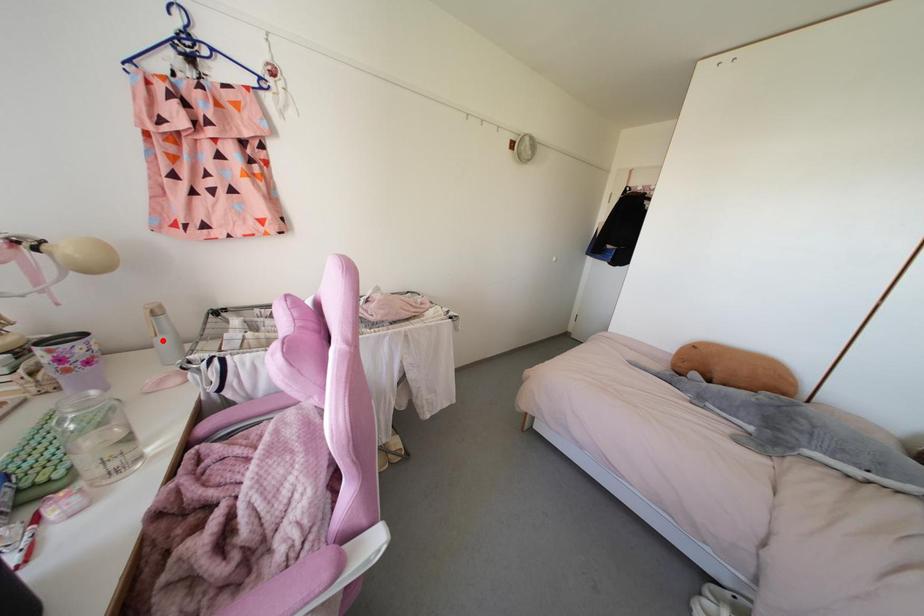
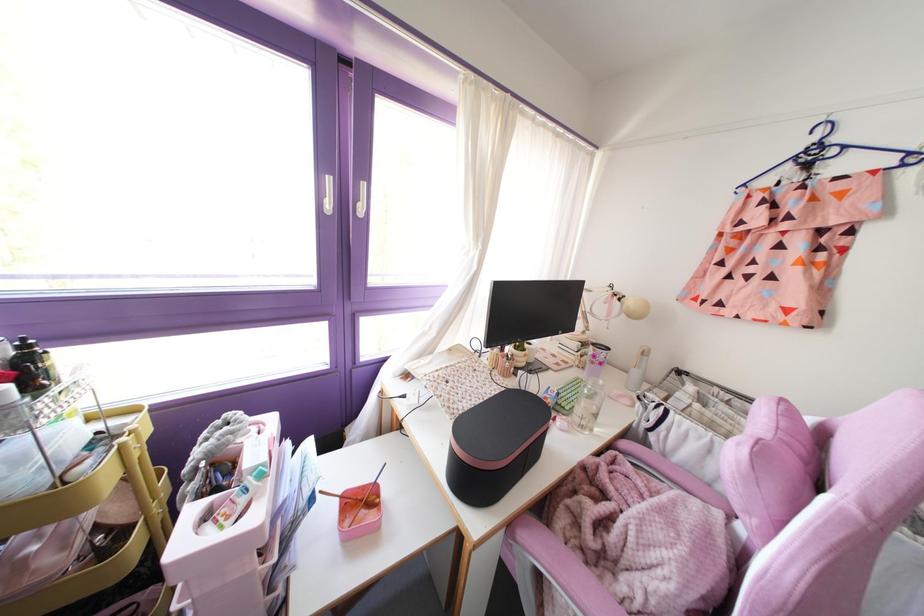
In the second image, find the point that corresponds to the highlighted location in the first image.

(634, 371)